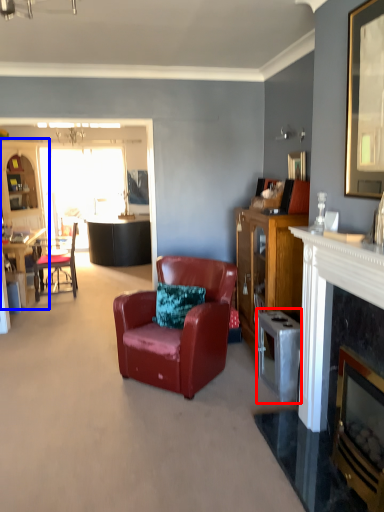
Question: Which object is closer to the camera taking this photo, appliance (highlighted by a red box) or entertainment center (highlighted by a blue box)?

Choices:
 (A) appliance
 (B) entertainment center

Answer: (A)